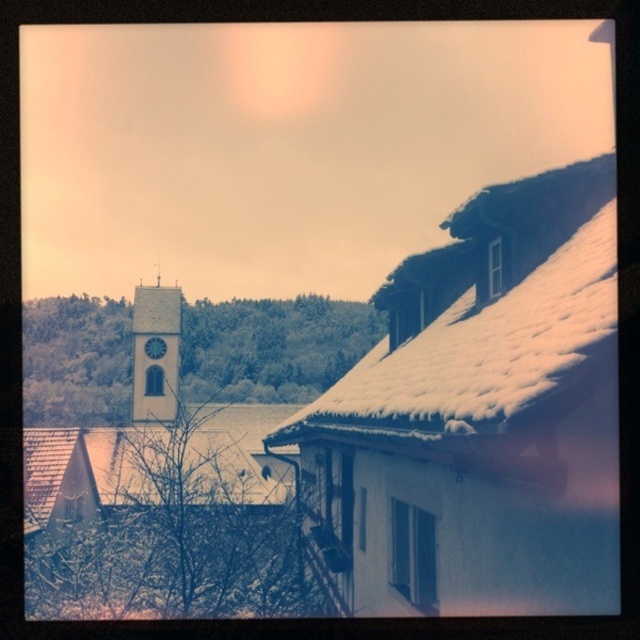
Looking at this image, you are an architect assessing the winter scene. You notice the white stone clock tower at center and the blue glossy clock at center. Which object is wider in terms of physical dimensions?

The white stone clock tower at center is wider than the blue glossy clock at center according to the description.

You are standing at the center of the image. Which direction should you look to see the white stone clock tower at center?

The white stone clock tower at center is located at point coordinates of (156,353), so you should look towards the center of the image to see it.